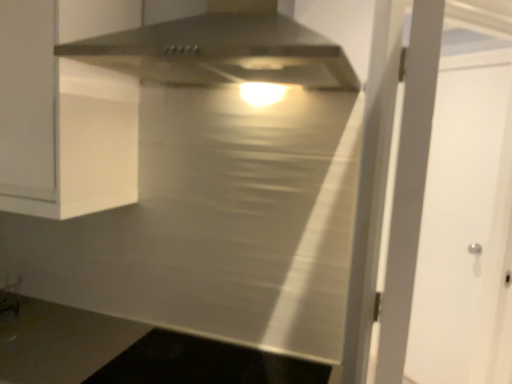
At what (x,y) coordinates should I click in order to perform the action: click on blank space above white matte door at right (from a real-world perspective). Please return your answer as a coordinate pair (x, y). Looking at the image, I should click on point(476,48).